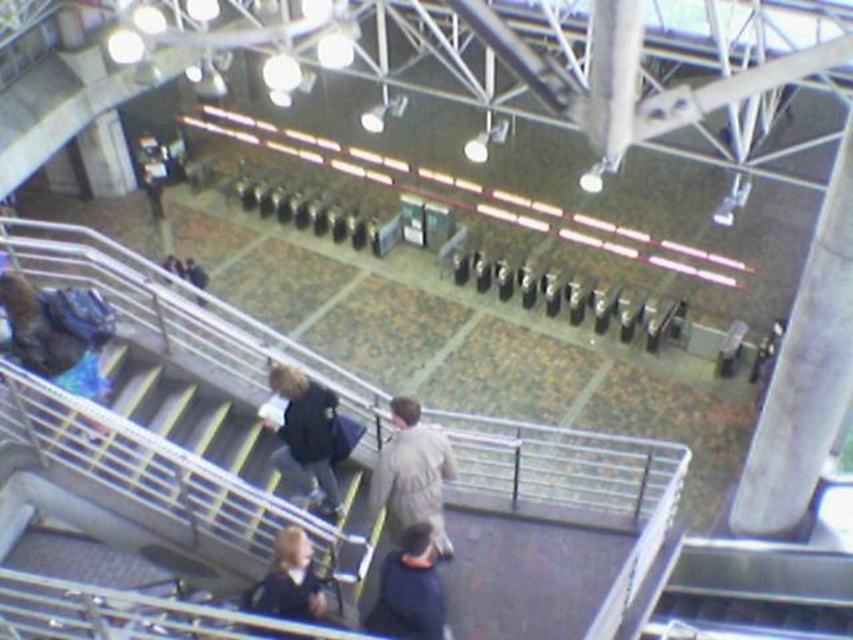
You are a traveler in the station and you see a dark blue jacket at center and a dark blue fabric at lower center. Which one is closer to the left side of the scene?

The dark blue jacket at center is to the left of dark blue fabric at lower center, so the dark blue jacket at center is closer to the left side of the scene.

You are standing at the bottom of the staircase in the train station. You see two points marked on the floor ahead of you. The first point is at coordinate point (404, 580) and the second point is at coordinate point (297, 552). Which point is closer to you?

Point (297, 552) is closer to you because it is less further away than point (404, 580).